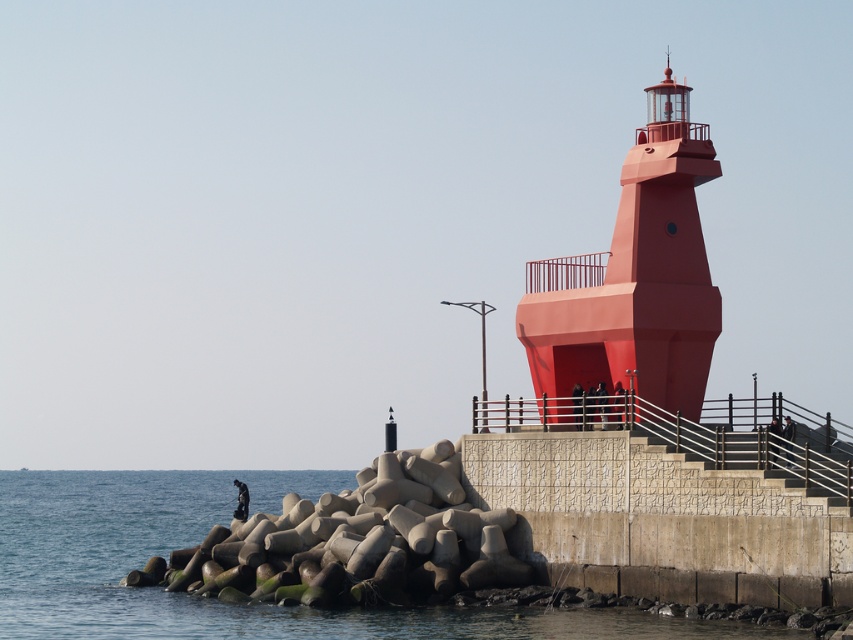
Looking at this image, you are standing on the platform of the red lighthouse and looking towards the sea. You see two areas of water, the transparent water at lower left and the blue concrete water at lower left. Which one is positioned to the right when viewed from your perspective?

The transparent water at lower left is positioned to the right of the blue concrete water at lower left from your perspective.